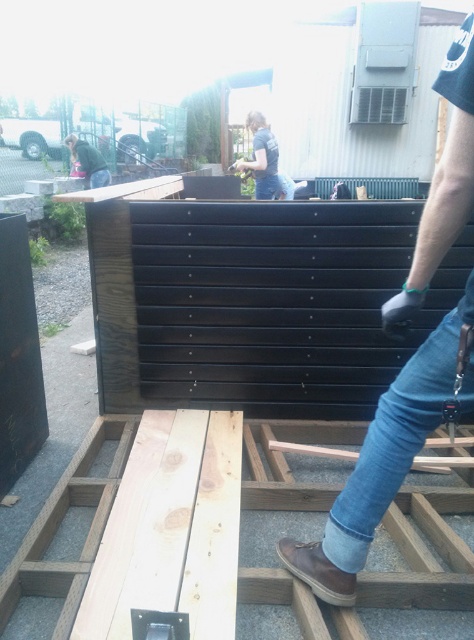
You are observing two people in the scene. One is wearing denim jeans at upper center and the other is wearing a green fabric jacket at upper left. Which clothing item is taller?

The denim jeans at upper center has a greater height compared to the green fabric jacket at upper left.

You are observing an outdoor woodworking project. You notice two people in the scene. One is wearing jeans at center and the other has a green fabric jacket at upper left. Based on their positions, which person is closer to the right side of the image?

The jeans at center is to the right of green fabric jacket at upper left, so the person wearing jeans at center is closer to the right side of the image.

You are observing two people in the outdoor woodworking scene. One is wearing denim jeans at upper center and the other has a green fabric jacket at upper left. Which clothing item is located higher in the image?

The denim jeans at upper center is positioned over the green fabric jacket at upper left, meaning it is higher in the image.